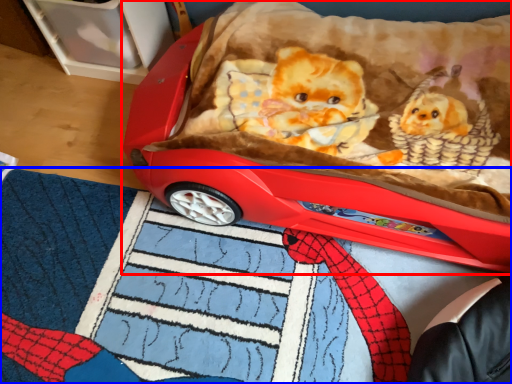
Question: Which of the following is the closest to the observer, toy (highlighted by a red box) or mat (highlighted by a blue box)?

Choices:
 (A) toy
 (B) mat

Answer: (B)